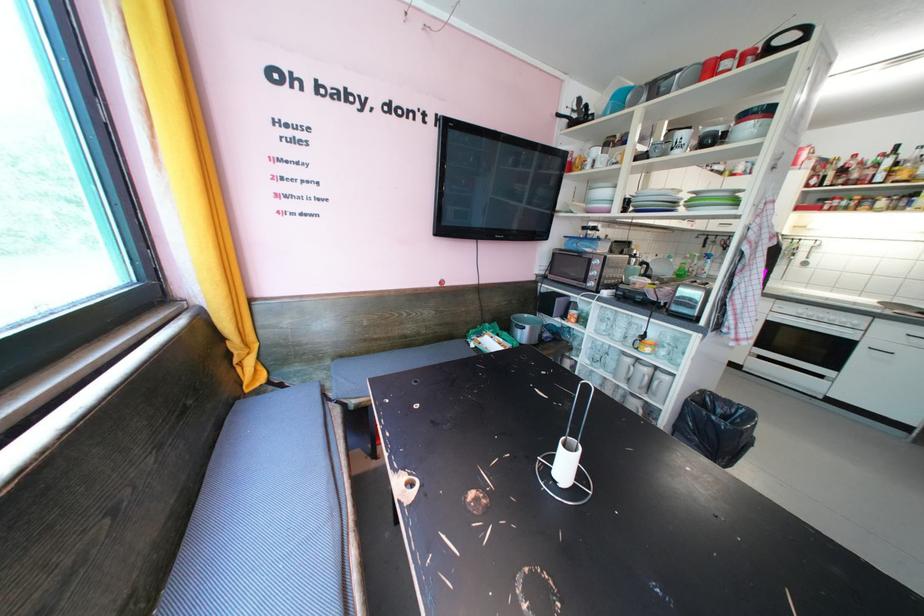
Identify the location of black trash bag. (715, 427).